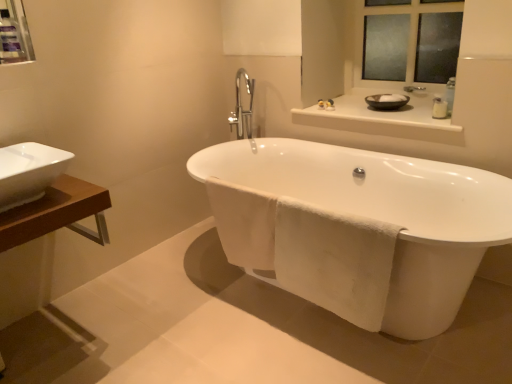
Question: Can you confirm if white ceramic sink at left is bigger than glossy ceramic mirror at upper center?

Choices:
 (A) yes
 (B) no

Answer: (B)

Question: From the image's perspective, is white ceramic sink at left over glossy ceramic mirror at upper center?

Choices:
 (A) yes
 (B) no

Answer: (B)

Question: Are white ceramic sink at left and glossy ceramic mirror at upper center far apart?

Choices:
 (A) yes
 (B) no

Answer: (A)

Question: Would you say white ceramic sink at left is outside glossy ceramic mirror at upper center?

Choices:
 (A) yes
 (B) no

Answer: (A)

Question: Would you say white ceramic sink at left contains glossy ceramic mirror at upper center?

Choices:
 (A) no
 (B) yes

Answer: (A)

Question: Can you confirm if white ceramic sink at left is smaller than glossy ceramic mirror at upper center?

Choices:
 (A) no
 (B) yes

Answer: (B)

Question: Can you see glossy ceramic mirror at upper center touching matte plastic medicine cabinet at upper left?

Choices:
 (A) yes
 (B) no

Answer: (B)

Question: Can you confirm if glossy ceramic mirror at upper center is wider than matte plastic medicine cabinet at upper left?

Choices:
 (A) no
 (B) yes

Answer: (B)

Question: Is glossy ceramic mirror at upper center oriented away from matte plastic medicine cabinet at upper left?

Choices:
 (A) no
 (B) yes

Answer: (A)

Question: Can you confirm if glossy ceramic mirror at upper center is taller than matte plastic medicine cabinet at upper left?

Choices:
 (A) no
 (B) yes

Answer: (B)

Question: From a real-world perspective, is glossy ceramic mirror at upper center positioned over matte plastic medicine cabinet at upper left based on gravity?

Choices:
 (A) no
 (B) yes

Answer: (A)

Question: Is glossy ceramic mirror at upper center smaller than matte plastic medicine cabinet at upper left?

Choices:
 (A) yes
 (B) no

Answer: (B)

Question: Can you confirm if matte plastic medicine cabinet at upper left is positioned to the right of white glossy bathtub at center?

Choices:
 (A) no
 (B) yes

Answer: (A)